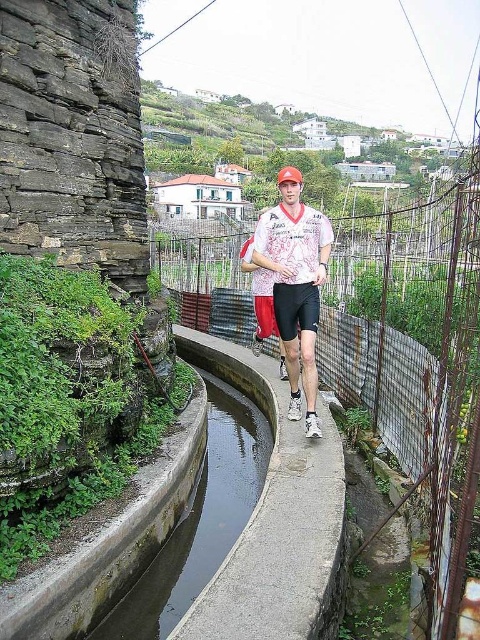
Between green concrete canal at center and white printed shirt at center, which one is positioned lower?

green concrete canal at center is lower down.

This screenshot has width=480, height=640. Describe the element at coordinates (201, 518) in the screenshot. I see `green concrete canal at center` at that location.

You are a GUI agent. You are given a task and a screenshot of the screen. Output one action in this format:
    pyautogui.click(x=<x>, y=<y>)
    Task: Click on the green concrete canal at center
    
    Given the screenshot: What is the action you would take?
    pyautogui.click(x=201, y=518)